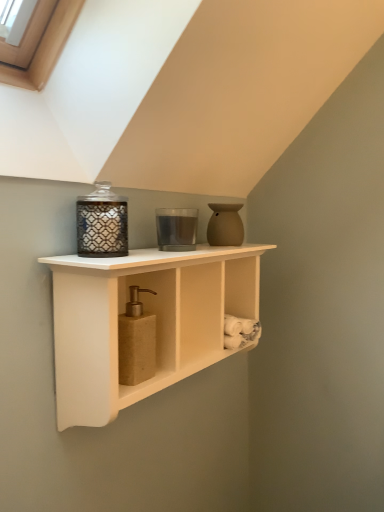
Question: Is translucent glass candle at center, which appears as the second candle holder when viewed from the left, surrounded by matte glass candle holder at upper left, positioned as the 2th candle holder in right-to-left order?

Choices:
 (A) no
 (B) yes

Answer: (A)

Question: Is matte glass candle holder at upper left, positioned as the 2th candle holder in right-to-left order, touching translucent glass candle at center, which appears as the second candle holder when viewed from the left?

Choices:
 (A) no
 (B) yes

Answer: (A)

Question: From a real-world perspective, is matte glass candle holder at upper left, the second candle holder positioned from the back, physically above translucent glass candle at center, the first candle holder positioned from the right?

Choices:
 (A) no
 (B) yes

Answer: (A)

Question: Is matte glass candle holder at upper left, the second candle holder positioned from the back, not near translucent glass candle at center, which appears as the second candle holder when viewed from the left?

Choices:
 (A) yes
 (B) no

Answer: (B)

Question: Does matte glass candle holder at upper left, positioned as the 2th candle holder in right-to-left order, have a larger size compared to translucent glass candle at center, marked as the second candle holder in a front-to-back arrangement?

Choices:
 (A) no
 (B) yes

Answer: (B)

Question: From the image's perspective, is translucent glass candle at center, acting as the first candle holder starting from the back, located above or below white wood shelf at center?

Choices:
 (A) below
 (B) above

Answer: (B)

Question: In the image, is translucent glass candle at center, acting as the first candle holder starting from the back, on the left side or the right side of white wood shelf at center?

Choices:
 (A) right
 (B) left

Answer: (B)

Question: From a real-world perspective, is translucent glass candle at center, the first candle holder positioned from the right, positioned above or below white wood shelf at center?

Choices:
 (A) above
 (B) below

Answer: (A)

Question: Is translucent glass candle at center, the first candle holder positioned from the right, situated inside white wood shelf at center or outside?

Choices:
 (A) inside
 (B) outside

Answer: (B)

Question: Considering the positions of matte glass candle holder at upper left, the 1th candle holder in the left-to-right sequence, and translucent glass candle at center, marked as the second candle holder in a front-to-back arrangement, in the image, is matte glass candle holder at upper left, the 1th candle holder in the left-to-right sequence, taller or shorter than translucent glass candle at center, marked as the second candle holder in a front-to-back arrangement,?

Choices:
 (A) tall
 (B) short

Answer: (A)

Question: Do you think matte glass candle holder at upper left, which is the 1th candle holder from front to back, is within translucent glass candle at center, marked as the second candle holder in a front-to-back arrangement, or outside of it?

Choices:
 (A) inside
 (B) outside

Answer: (B)

Question: Is matte glass candle holder at upper left, the 1th candle holder in the left-to-right sequence, wider or thinner than translucent glass candle at center, which appears as the second candle holder when viewed from the left?

Choices:
 (A) thin
 (B) wide

Answer: (B)

Question: Considering the positions of matte glass candle holder at upper left, which is the 1th candle holder from front to back, and translucent glass candle at center, the first candle holder positioned from the right, in the image, is matte glass candle holder at upper left, which is the 1th candle holder from front to back, bigger or smaller than translucent glass candle at center, the first candle holder positioned from the right,?

Choices:
 (A) big
 (B) small

Answer: (A)

Question: From their relative heights in the image, would you say translucent glass candle at center, which appears as the second candle holder when viewed from the left, is taller or shorter than matte beige vase at upper right?

Choices:
 (A) tall
 (B) short

Answer: (B)

Question: Relative to matte beige vase at upper right, is translucent glass candle at center, which appears as the second candle holder when viewed from the left, in front or behind?

Choices:
 (A) front
 (B) behind

Answer: (A)